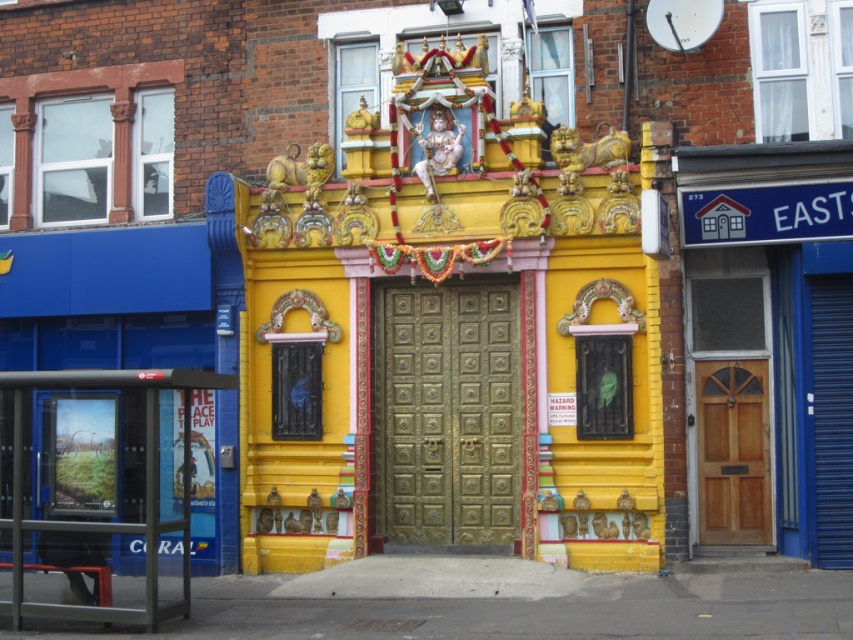
You are a visitor at the temple entrance and want to enter. You see two doors in front of you, the gold textured door at center and the wooden door at center. Which door should you use to enter the temple?

The gold textured door at center has a larger size compared to the wooden door at center, so you should use the gold textured door at center to enter the temple as it is the main entrance.

You are a visitor approaching the entrance of the temple. You see the metallic bus stop at lower left and the wooden door at center. Which object is closer to you as you approach the entrance?

Answer: The metallic bus stop at lower left is positioned over the wooden door at center, meaning it is closer to you as you approach the entrance.

You are standing at the entrance of the temple and need to locate both the gold textured door at center and the metallic bus stop at lower left. From your perspective, which object is positioned to the right side?

The gold textured door at center is positioned to the right of the metallic bus stop at lower left, so it is the one on the right side.